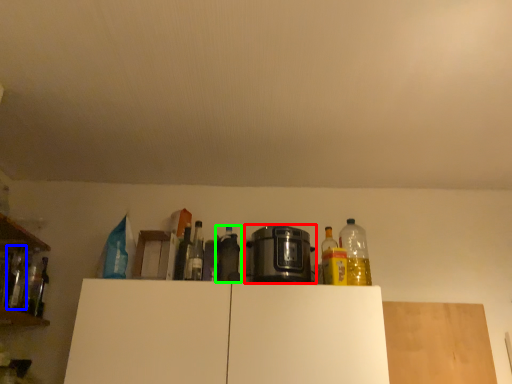
Question: Considering the real-world distances, which object is farthest from home appliance (highlighted by a red box)? bottle (highlighted by a blue box) or bottle (highlighted by a green box)?

Choices:
 (A) bottle
 (B) bottle

Answer: (A)